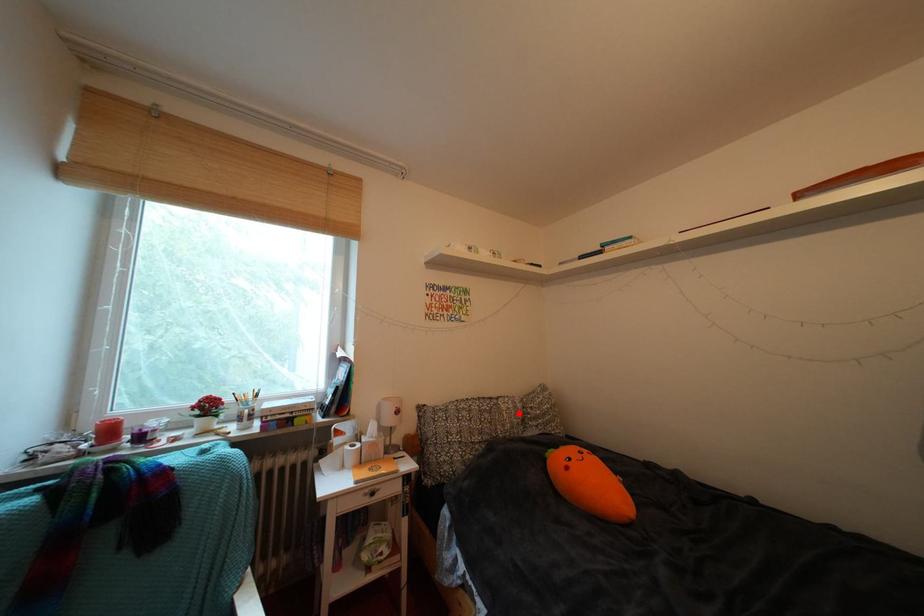
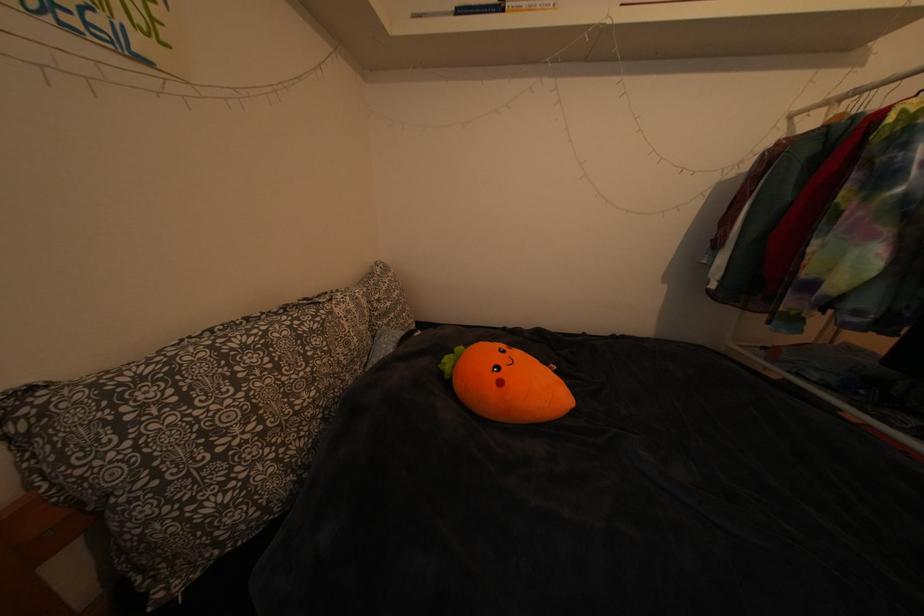
Locate, in the second image, the point that corresponds to the highlighted location in the first image.

(359, 317)